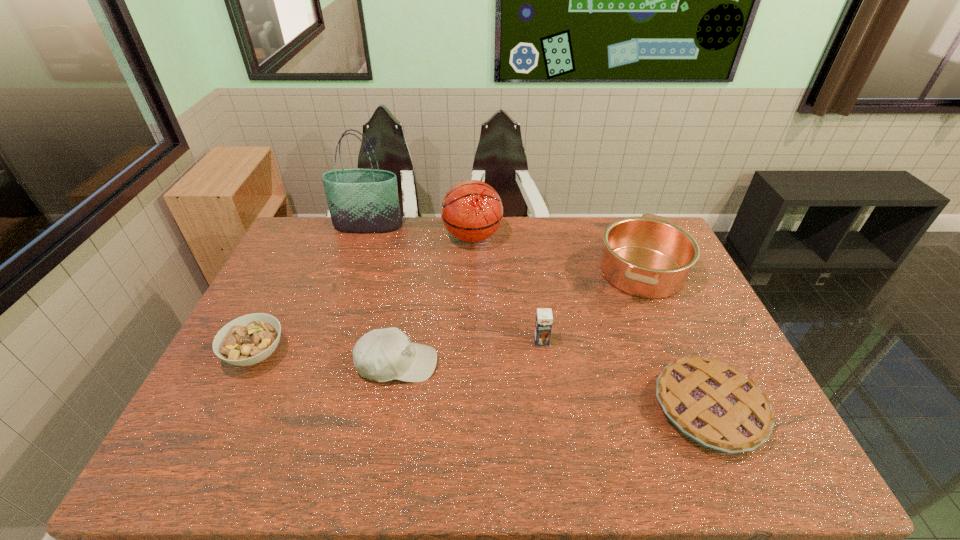
This screenshot has width=960, height=540. Find the location of `vacant area that satisfies the following two spatial constraints: 1. on the front label of the pie; 2. on the right side of the fifth object from left to right`. vacant area that satisfies the following two spatial constraints: 1. on the front label of the pie; 2. on the right side of the fifth object from left to right is located at coordinates (551, 409).